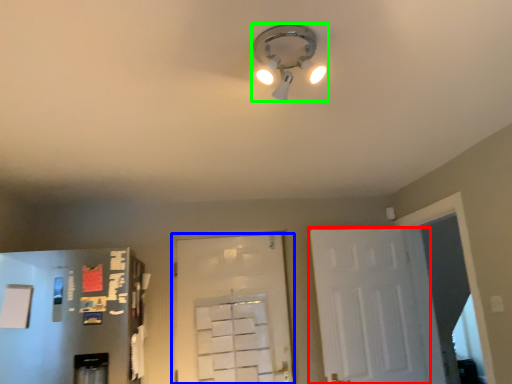
Question: Based on their relative distances, which object is farther from door (highlighted by a red box)? Choose from door (highlighted by a blue box) and lamp (highlighted by a green box).

Choices:
 (A) door
 (B) lamp

Answer: (B)